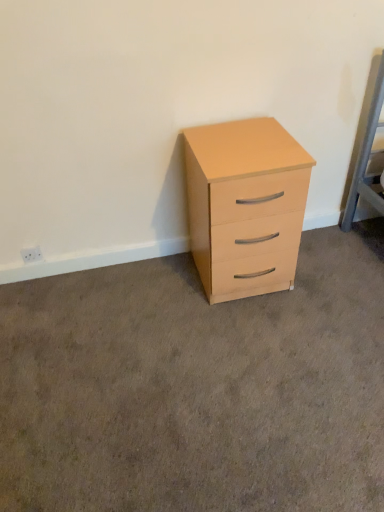
Question: Is light wood/finish chest of drawers at center bigger or smaller than light wood drawer at center?

Choices:
 (A) big
 (B) small

Answer: (A)

Question: Looking at their shapes, would you say light wood/finish chest of drawers at center is wider or thinner than light wood drawer at center?

Choices:
 (A) wide
 (B) thin

Answer: (B)

Question: From the image's perspective, is light wood/finish chest of drawers at center above or below light wood drawer at center?

Choices:
 (A) above
 (B) below

Answer: (A)

Question: In the image, is light wood drawer at center on the left side or the right side of light wood/finish chest of drawers at center?

Choices:
 (A) right
 (B) left

Answer: (A)

Question: Is light wood drawer at center inside or outside of light wood/finish chest of drawers at center?

Choices:
 (A) inside
 (B) outside

Answer: (B)

Question: From a real-world perspective, relative to light wood/finish chest of drawers at center, is light wood drawer at center vertically above or below?

Choices:
 (A) below
 (B) above

Answer: (A)

Question: Relative to light wood/finish chest of drawers at center, is light wood drawer at center in front or behind?

Choices:
 (A) front
 (B) behind

Answer: (A)